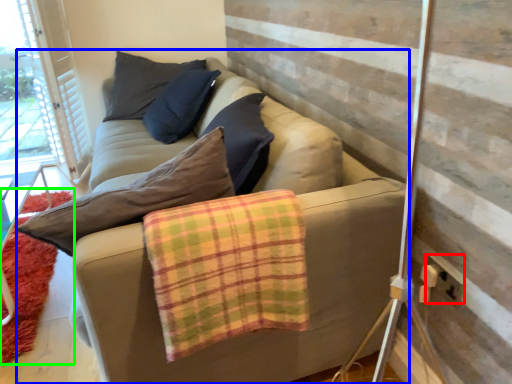
Question: Which object is the farthest from electric outlet (highlighted by a red box)? Choose among these: studio couch (highlighted by a blue box) or mat (highlighted by a green box).

Choices:
 (A) studio couch
 (B) mat

Answer: (B)